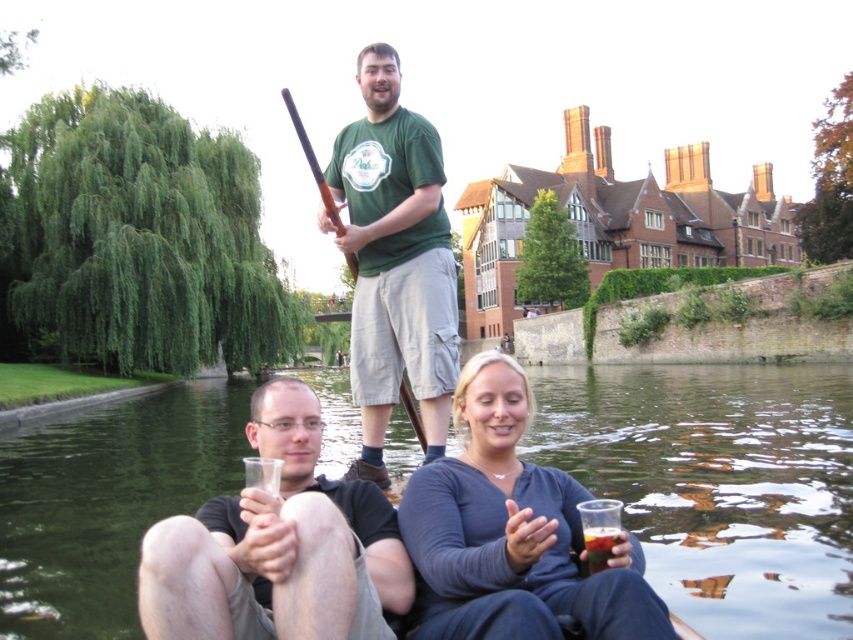
Between point (12, 444) and point (599, 548), which one is positioned behind?

The point (12, 444) is more distant.

Is greenish water at center positioned in front of translucent glass at lower right?

No, greenish water at center is behind translucent glass at lower right.

Where is `greenish water at center`? The image size is (853, 640). greenish water at center is located at coordinates (718, 483).

Is matte black t-shirt at lower center bigger than matte gray sweater at center?

Yes, matte black t-shirt at lower center is bigger than matte gray sweater at center.

Does matte black t-shirt at lower center have a lesser width compared to matte gray sweater at center?

Incorrect, matte black t-shirt at lower center's width is not less than matte gray sweater at center's.

Is point (169, 557) positioned after point (485, 432)?

No, (169, 557) is closer to viewer.

Locate an element on the screen. matte black t-shirt at lower center is located at coordinates (277, 547).

Does matte black t-shirt at lower center have a lesser width compared to green t-shirt at center?

No.

Can you confirm if matte black t-shirt at lower center is positioned above green t-shirt at center?

Incorrect, matte black t-shirt at lower center is not positioned above green t-shirt at center.

In the scene shown: Who is more distant from viewer, (216,608) or (369,65)?

Positioned behind is point (369,65).

Where is `matte black t-shirt at lower center`? matte black t-shirt at lower center is located at coordinates (277, 547).